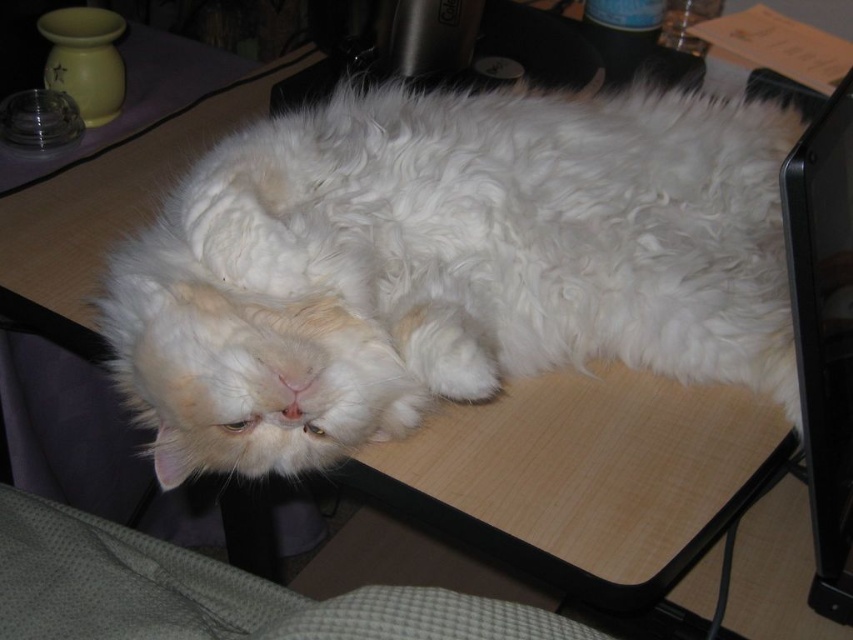
You are a photographer setting up a shoot in this scene. You need to position a light source so it illuminates both the white fluffy cat at center and the black glossy monitor at right equally. Considering their positions, which object is closer to you and might require adjusting the light angle?

The white fluffy cat at center is closer to you than the black glossy monitor at right, so you should adjust the light angle to ensure both receive equal illumination.

You are organizing your desk and need to move the black glossy monitor at right closer to the wall. The white fluffy cat at center is currently in the way. Which direction should you gently nudge the cat to so it moves out of the way?

You should gently nudge the white fluffy cat at center to the left since it is currently to the left of the black glossy monitor at right and needs to move away from the monitor to clear the path.